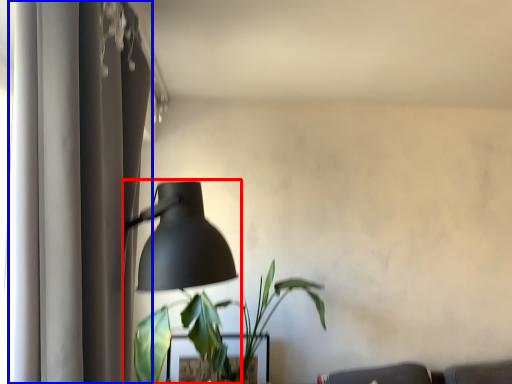
Question: Which of the following is the farthest to the observer, lamp (highlighted by a red box) or curtain (highlighted by a blue box)?

Choices:
 (A) lamp
 (B) curtain

Answer: (A)